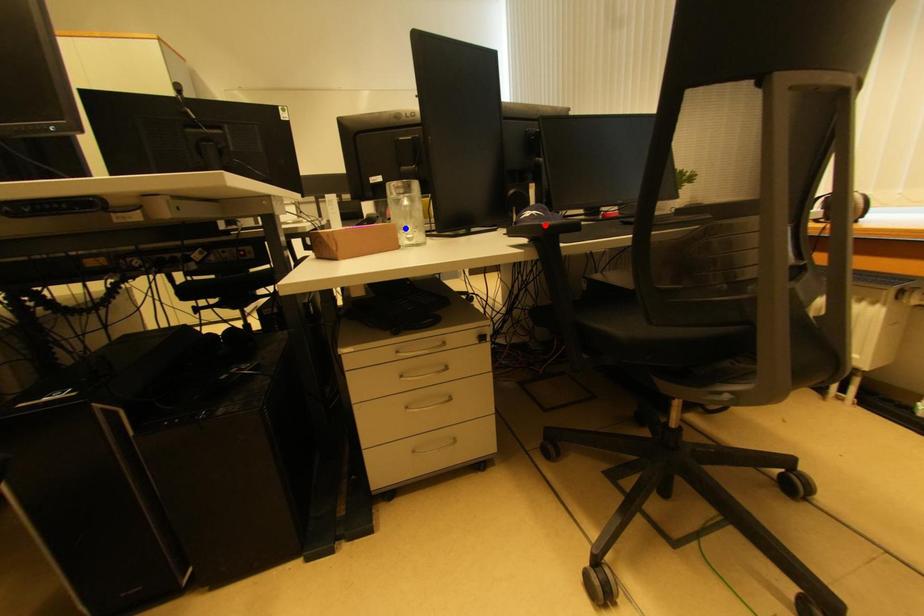
Question: Which of the two points in the image is closer to the camera?

Choices:
 (A) Blue point is closer.
 (B) Red point is closer.

Answer: (B)